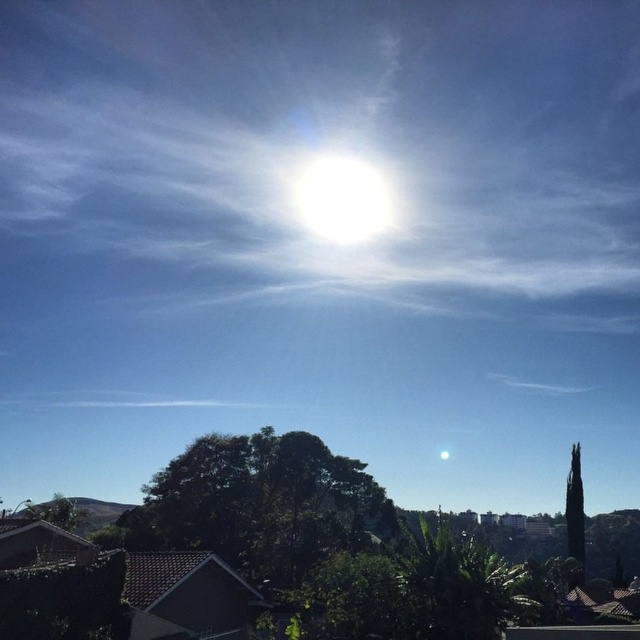
Is point (348, 504) less distant than point (305, 196)?

That is True.

Which of these two, green leafy tree at center or white glossy sun at center, stands shorter?

green leafy tree at center

The width and height of the screenshot is (640, 640). What are the coordinates of `green leafy tree at center` in the screenshot? It's located at (260, 502).

In order to click on green leafy tree at center in this screenshot , I will do `click(260, 502)`.